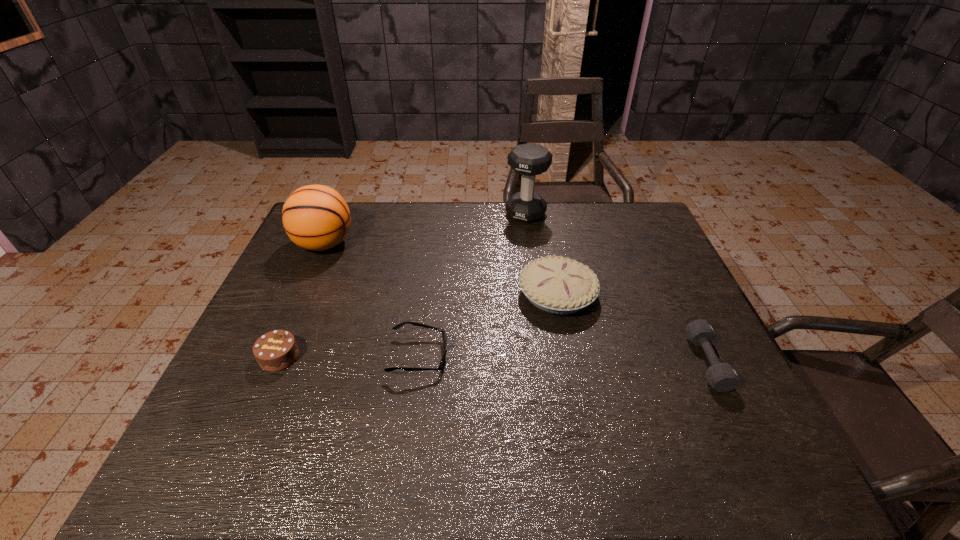
I want to click on object situated at the right edge, so click(722, 377).

This screenshot has width=960, height=540. What are the coordinates of `object that is at the far left corner` in the screenshot? It's located at (315, 217).

The height and width of the screenshot is (540, 960). Find the location of `vacant space at the far edge`. vacant space at the far edge is located at coordinates (411, 242).

Image resolution: width=960 pixels, height=540 pixels. Identify the location of free space at the left edge of the desktop. (314, 256).

Locate an element on the screen. vacant space at the right edge is located at coordinates (742, 426).

This screenshot has height=540, width=960. I want to click on free region at the near left corner of the desktop, so click(180, 471).

Locate an element on the screen. free space at the far right corner of the desktop is located at coordinates [x=639, y=228].

Where is `free area in between the taller dumbbell and the fourth nearest object`? The width and height of the screenshot is (960, 540). free area in between the taller dumbbell and the fourth nearest object is located at coordinates (541, 254).

You are a GUI agent. You are given a task and a screenshot of the screen. Output one action in this format:
    pyautogui.click(x=<x>, y=<y>)
    Task: Click on the free space that is in between the farthest object and the fourth nearest object
    The image size is (960, 540).
    Given the screenshot: What is the action you would take?
    pyautogui.click(x=541, y=254)

Find the location of a particular element. The image size is (960, 540). free space between the shorter dumbbell and the chocolate cake is located at coordinates (493, 359).